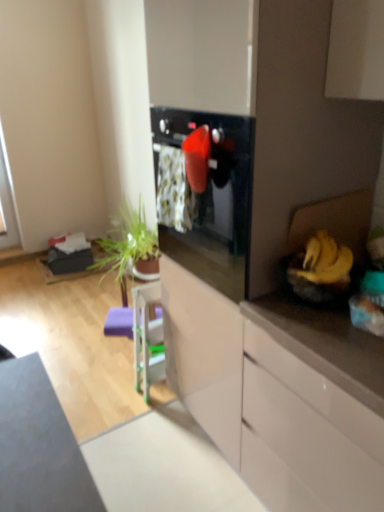
The width and height of the screenshot is (384, 512). What do you see at coordinates (268, 405) in the screenshot?
I see `white glossy cabinet at center, arranged as the first cabinetry when viewed from the back` at bounding box center [268, 405].

How much space does white glossy cabinet at center, the 2th cabinetry when ordered from front to back, occupy horizontally?

It is 3.07 meters.

What do you see at coordinates (306, 434) in the screenshot? I see `white glossy cabinet at right, the 2th cabinetry viewed from the back` at bounding box center [306, 434].

Where is `white glossy dresser at center`? Image resolution: width=384 pixels, height=512 pixels. white glossy dresser at center is located at coordinates (268, 256).

What do you see at coordinates (325, 260) in the screenshot? Image resolution: width=384 pixels, height=512 pixels. I see `yellow matte banana at right` at bounding box center [325, 260].

Image resolution: width=384 pixels, height=512 pixels. Identify the location of white glossy cabinet at center, arranged as the first cabinetry when viewed from the back. (268, 405).

Consider the image. Is white glossy cabinet at right, which ranks as the first cabinetry in front-to-back order, oriented away from white glossy cabinet at center, the 2th cabinetry when ordered from front to back?

No, white glossy cabinet at center, the 2th cabinetry when ordered from front to back, is not at the back of white glossy cabinet at right, which ranks as the first cabinetry in front-to-back order.

Looking at the image, does white glossy cabinet at right, the 2th cabinetry viewed from the back, seem bigger or smaller compared to white glossy cabinet at center, arranged as the first cabinetry when viewed from the back?

In the image, white glossy cabinet at right, the 2th cabinetry viewed from the back, appears to be smaller than white glossy cabinet at center, arranged as the first cabinetry when viewed from the back.

Considering the relative sizes of white glossy cabinet at right, which ranks as the first cabinetry in front-to-back order, and white glossy cabinet at center, the 2th cabinetry when ordered from front to back, in the image provided, is white glossy cabinet at right, which ranks as the first cabinetry in front-to-back order, taller than white glossy cabinet at center, the 2th cabinetry when ordered from front to back,?

Indeed, white glossy cabinet at right, which ranks as the first cabinetry in front-to-back order, has a greater height compared to white glossy cabinet at center, the 2th cabinetry when ordered from front to back.

Visually, is white glossy cabinet at right, which ranks as the first cabinetry in front-to-back order, positioned to the left or to the right of white glossy dresser at center?

In the image, white glossy cabinet at right, which ranks as the first cabinetry in front-to-back order, appears on the right side of white glossy dresser at center.

This screenshot has height=512, width=384. I want to click on cabinetry in front of the white glossy dresser at center, so click(306, 434).

Is white glossy cabinet at right, the 2th cabinetry viewed from the back, touching white glossy dresser at center?

They are not placed beside each other.

From the image's perspective, is white glossy cabinet at right, which ranks as the first cabinetry in front-to-back order, positioned above or below white glossy dresser at center?

Based on their image positions, white glossy cabinet at right, which ranks as the first cabinetry in front-to-back order, is located beneath white glossy dresser at center.

Between point (239, 322) and point (323, 259), which one is positioned in front?

The point (323, 259) is closer.

Is white glossy cabinet at center, arranged as the first cabinetry when viewed from the back, located outside yellow matte banana at right?

Yes, white glossy cabinet at center, arranged as the first cabinetry when viewed from the back, is located beyond the bounds of yellow matte banana at right.

Can you confirm if white glossy cabinet at center, the 2th cabinetry when ordered from front to back, is positioned to the left of yellow matte banana at right?

Yes, white glossy cabinet at center, the 2th cabinetry when ordered from front to back, is to the left of yellow matte banana at right.

From the image's perspective, would you say white glossy cabinet at center, the 2th cabinetry when ordered from front to back, is shown under yellow matte banana at right?

Yes.

Does yellow matte banana at right touch white glossy dresser at center?

yellow matte banana at right is not next to white glossy dresser at center, and they're not touching.

What's the angular difference between yellow matte banana at right and white glossy dresser at center's facing directions?

yellow matte banana at right and white glossy dresser at center are facing 0.69 degrees away from each other.

In terms of width, does yellow matte banana at right look wider or thinner when compared to white glossy dresser at center?

Considering their sizes, yellow matte banana at right looks slimmer than white glossy dresser at center.

Is white glossy cabinet at center, the 2th cabinetry when ordered from front to back, taller or shorter than white glossy dresser at center?

In the image, white glossy cabinet at center, the 2th cabinetry when ordered from front to back, appears to be shorter than white glossy dresser at center.

Which point is more forward, [199,409] or [157,120]?

Positioned in front is point [157,120].

From the picture: Are white glossy cabinet at center, arranged as the first cabinetry when viewed from the back, and white glossy dresser at center located far from each other?

No.

Between point (251, 217) and point (335, 275), which one is positioned behind?

The point (251, 217) is behind.

In the scene shown: Which of these two, white glossy dresser at center or yellow matte banana at right, is smaller?

With smaller size is yellow matte banana at right.

From the image's perspective, which is below, white glossy dresser at center or yellow matte banana at right?

yellow matte banana at right appears lower in the image.

Is white glossy dresser at center spatially inside yellow matte banana at right, or outside of it?

white glossy dresser at center is not inside yellow matte banana at right, it's outside.

Locate an element on the screen. dresser above the white glossy cabinet at right, which ranks as the first cabinetry in front-to-back order (from a real-world perspective) is located at coordinates (268, 256).

From a real-world perspective, is white glossy dresser at center positioned above or below white glossy cabinet at right, the 2th cabinetry viewed from the back?

Clearly, from a real-world perspective, white glossy dresser at center is above white glossy cabinet at right, the 2th cabinetry viewed from the back.

Which of these two, white glossy dresser at center or white glossy cabinet at right, which ranks as the first cabinetry in front-to-back order, is thinner?

white glossy dresser at center.

Locate an element on the screen. This screenshot has height=512, width=384. cabinetry that is behind the white glossy cabinet at right, which ranks as the first cabinetry in front-to-back order is located at coordinates (268, 405).

The height and width of the screenshot is (512, 384). I want to click on the 1st cabinetry located beneath the white glossy dresser at center (from a real-world perspective), so click(306, 434).

Estimate the real-world distances between objects in this image. Which object is further from yellow matte banana at right, white glossy cabinet at center, the 2th cabinetry when ordered from front to back, or white glossy cabinet at right, the 2th cabinetry viewed from the back?

white glossy cabinet at center, the 2th cabinetry when ordered from front to back, is positioned further to the anchor yellow matte banana at right.

When comparing their distances from yellow matte banana at right, does white glossy dresser at center or white glossy cabinet at center, arranged as the first cabinetry when viewed from the back, seem further?

Among the two, white glossy cabinet at center, arranged as the first cabinetry when viewed from the back, is located further to yellow matte banana at right.

Based on their spatial positions, is white glossy dresser at center or yellow matte banana at right further from white glossy cabinet at center, the 2th cabinetry when ordered from front to back?

yellow matte banana at right is further to white glossy cabinet at center, the 2th cabinetry when ordered from front to back.

Looking at the image, which one is located closer to white glossy dresser at center, white glossy cabinet at right, the 2th cabinetry viewed from the back, or yellow matte banana at right?

white glossy cabinet at right, the 2th cabinetry viewed from the back, lies closer to white glossy dresser at center than the other object.

From the picture: Based on their spatial positions, is white glossy cabinet at right, the 2th cabinetry viewed from the back, or white glossy dresser at center further from white glossy cabinet at center, arranged as the first cabinetry when viewed from the back?

Among the two, white glossy dresser at center is located further to white glossy cabinet at center, arranged as the first cabinetry when viewed from the back.

Which object lies nearer to the anchor point white glossy dresser at center, white glossy cabinet at center, arranged as the first cabinetry when viewed from the back, or yellow matte banana at right?

The object closer to white glossy dresser at center is white glossy cabinet at center, arranged as the first cabinetry when viewed from the back.

Which object lies further to the anchor point white glossy cabinet at center, the 2th cabinetry when ordered from front to back, yellow matte banana at right or white glossy dresser at center?

The object further to white glossy cabinet at center, the 2th cabinetry when ordered from front to back, is yellow matte banana at right.

When comparing their distances from white glossy cabinet at right, the 2th cabinetry viewed from the back, does white glossy cabinet at center, the 2th cabinetry when ordered from front to back, or yellow matte banana at right seem further?

yellow matte banana at right.

This screenshot has width=384, height=512. Find the location of `banana between white glossy cabinet at center, the 2th cabinetry when ordered from front to back, and white glossy cabinet at right, which ranks as the first cabinetry in front-to-back order, in the horizontal direction`. banana between white glossy cabinet at center, the 2th cabinetry when ordered from front to back, and white glossy cabinet at right, which ranks as the first cabinetry in front-to-back order, in the horizontal direction is located at coordinates (325, 260).

Identify the location of banana between white glossy dresser at center and white glossy cabinet at right, which ranks as the first cabinetry in front-to-back order, vertically. The image size is (384, 512). (325, 260).

Identify the location of dresser situated between white glossy cabinet at center, the 2th cabinetry when ordered from front to back, and yellow matte banana at right from left to right. (268, 256).

This screenshot has height=512, width=384. Find the location of `dresser between white glossy cabinet at center, the 2th cabinetry when ordered from front to back, and white glossy cabinet at right, which ranks as the first cabinetry in front-to-back order, in the horizontal direction`. dresser between white glossy cabinet at center, the 2th cabinetry when ordered from front to back, and white glossy cabinet at right, which ranks as the first cabinetry in front-to-back order, in the horizontal direction is located at coordinates (268, 256).